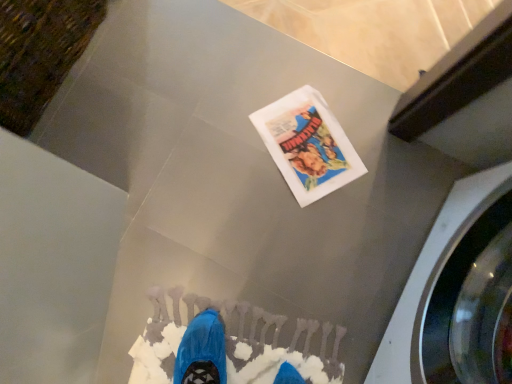
Measure the distance between metallic gray washing machine at right and camera.

The distance of metallic gray washing machine at right from camera is 30.16 inches.

Image resolution: width=512 pixels, height=384 pixels. Describe the element at coordinates (429, 274) in the screenshot. I see `metallic gray washing machine at right` at that location.

I want to click on metallic gray washing machine at right, so click(429, 274).

At what (x,y) coordinates should I click in order to perform the action: click on white paper flyer at center. Please return your answer as a coordinate pair (x, y). Looking at the image, I should click on (307, 144).

Describe the element at coordinates (307, 144) in the screenshot. I see `white paper flyer at center` at that location.

At what (x,y) coordinates should I click in order to perform the action: click on metallic gray washing machine at right. Please return your answer as a coordinate pair (x, y). Looking at the image, I should click on (429, 274).

Between white paper flyer at center and metallic gray washing machine at right, which one appears on the right side from the viewer's perspective?

Positioned to the right is metallic gray washing machine at right.

Which object is closer to the camera taking this photo, white paper flyer at center or metallic gray washing machine at right?

metallic gray washing machine at right is closer to the camera.

Is point (340, 183) closer or farther from the camera than point (401, 294)?

Point (340, 183) appears to be farther away from the viewer than point (401, 294).

From the image's perspective, which one is positioned lower, white paper flyer at center or metallic gray washing machine at right?

→ metallic gray washing machine at right, from the image's perspective.

From a real-world perspective, who is located lower, white paper flyer at center or metallic gray washing machine at right?

white paper flyer at center is physically lower.

Which of these two, white paper flyer at center or metallic gray washing machine at right, is thinner?

white paper flyer at center.

Who is taller, white paper flyer at center or metallic gray washing machine at right?

Standing taller between the two is metallic gray washing machine at right.

Looking at this image, considering the sizes of white paper flyer at center and metallic gray washing machine at right in the image, is white paper flyer at center bigger or smaller than metallic gray washing machine at right?

Clearly, white paper flyer at center is smaller in size than metallic gray washing machine at right.

Is white paper flyer at center situated inside metallic gray washing machine at right or outside?

white paper flyer at center exists outside the volume of metallic gray washing machine at right.

Is white paper flyer at center positioned far away from metallic gray washing machine at right?

No.

Consider the image. Could you tell me if white paper flyer at center is turned towards metallic gray washing machine at right?

No, white paper flyer at center is not facing towards metallic gray washing machine at right.

In order to click on flyer behind the metallic gray washing machine at right in this screenshot , I will do `click(307, 144)`.

Visually, is metallic gray washing machine at right positioned to the left or to the right of white paper flyer at center?

Clearly, metallic gray washing machine at right is on the right of white paper flyer at center in the image.

Based on the photo, is metallic gray washing machine at right further to the viewer compared to white paper flyer at center?

A: No, it is not.

Considering the positions of point (437, 261) and point (315, 127), is point (437, 261) closer or farther from the camera than point (315, 127)?

Point (437, 261) is positioned closer to the camera compared to point (315, 127).

From the image's perspective, is metallic gray washing machine at right on top of white paper flyer at center?

No, from the image's perspective, metallic gray washing machine at right is not over white paper flyer at center.

From a real-world perspective, is metallic gray washing machine at right under white paper flyer at center?

Incorrect, from a real-world perspective, metallic gray washing machine at right is higher than white paper flyer at center.

Is metallic gray washing machine at right wider than white paper flyer at center?

Yes, metallic gray washing machine at right is wider than white paper flyer at center.

Consider the image. In terms of height, does metallic gray washing machine at right look taller or shorter compared to white paper flyer at center?

metallic gray washing machine at right is taller than white paper flyer at center.

Between metallic gray washing machine at right and white paper flyer at center, which one has larger size?

metallic gray washing machine at right is bigger.

Do you think metallic gray washing machine at right is within white paper flyer at center, or outside of it?

metallic gray washing machine at right lies outside white paper flyer at center.

Are metallic gray washing machine at right and white paper flyer at center located far from each other?

They are positioned close to each other.

Could you tell me if metallic gray washing machine at right is turned towards white paper flyer at center?

Yes, metallic gray washing machine at right is oriented towards white paper flyer at center.

How different are the orientations of metallic gray washing machine at right and white paper flyer at center in degrees?

There is a 56.6-degree angle between the facing directions of metallic gray washing machine at right and white paper flyer at center.

Locate an element on the screen. washing machine on the right of white paper flyer at center is located at coordinates (429, 274).

The image size is (512, 384). I want to click on washing machine that appears below the white paper flyer at center (from the image's perspective), so click(x=429, y=274).

The height and width of the screenshot is (384, 512). In order to click on washing machine that appears in front of the white paper flyer at center in this screenshot , I will do `click(429, 274)`.